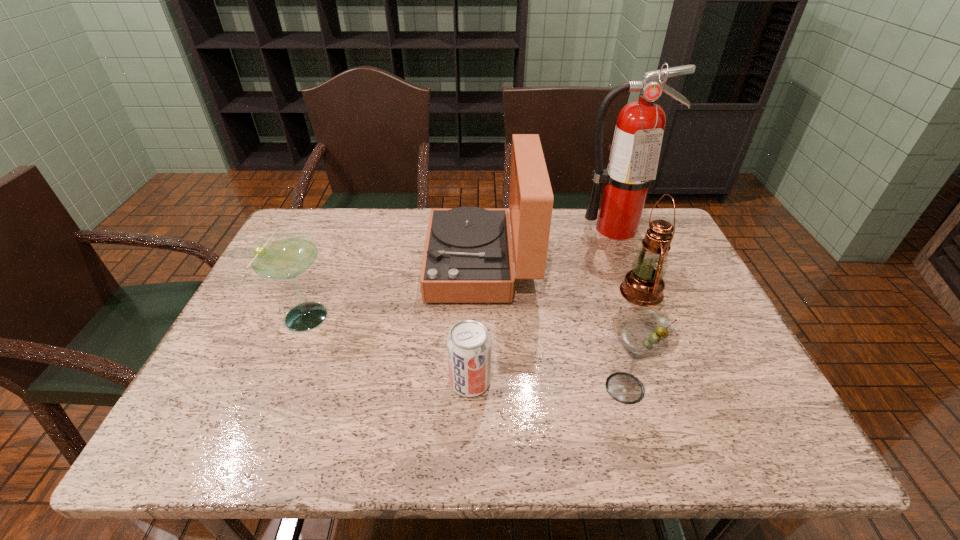
Identify the location of oil lamp located in the right edge section of the desktop. (643, 285).

In order to click on object that is at the far right corner in this screenshot , I will do `click(635, 151)`.

Find the location of a particular element. This screenshot has width=960, height=540. vacant region at the far edge is located at coordinates click(x=584, y=244).

In the image, there is a desktop. What are the coordinates of `vacant space at the near edge` in the screenshot? It's located at pyautogui.click(x=566, y=424).

Where is `blank space at the right edge`? The height and width of the screenshot is (540, 960). blank space at the right edge is located at coordinates (695, 374).

The height and width of the screenshot is (540, 960). What are the coordinates of `free location at the near left corner` in the screenshot? It's located at (254, 440).

Identify the location of free space between the phonograph record and the nearer martini. The image size is (960, 540). 553,326.

What are the coordinates of `vacant space in between the right martini and the tallest object` in the screenshot? It's located at (620, 308).

This screenshot has width=960, height=540. I want to click on vacant point located between the phonograph record and the farther martini, so click(x=395, y=289).

Locate an element on the screen. Image resolution: width=960 pixels, height=540 pixels. free spot between the farther martini and the phonograph record is located at coordinates (395, 289).